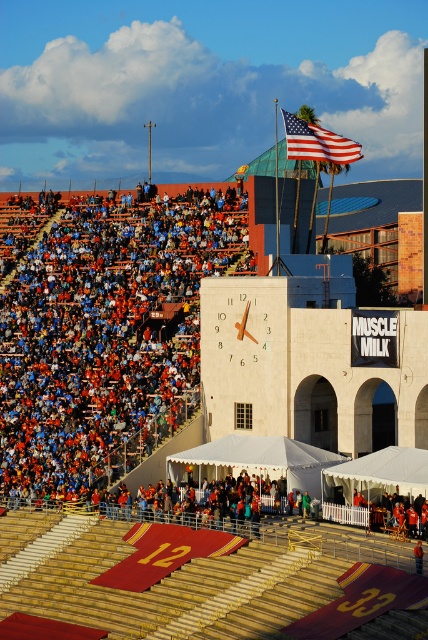
You are a photographer standing at the edge of the stadium field, aiming to capture the orange fabric seats at upper left and the american flag at upper center in your shot. Which object will appear larger in your photo?

The orange fabric seats at upper left will appear larger in the photo because they are closer to the viewer than the american flag at upper center.